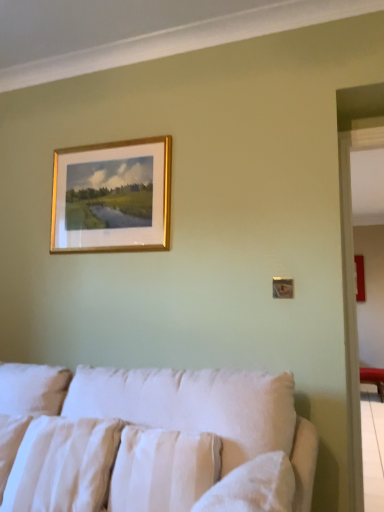
Question: Does gold-framed painting at upper center have a larger size compared to white fabric couch at lower center?

Choices:
 (A) no
 (B) yes

Answer: (A)

Question: From the image's perspective, is gold-framed painting at upper center on white fabric couch at lower center?

Choices:
 (A) yes
 (B) no

Answer: (A)

Question: Is gold-framed painting at upper center shorter than white fabric couch at lower center?

Choices:
 (A) no
 (B) yes

Answer: (B)

Question: Is gold-framed painting at upper center taller than white fabric couch at lower center?

Choices:
 (A) no
 (B) yes

Answer: (A)

Question: From a real-world perspective, is gold-framed painting at upper center physically below white fabric couch at lower center?

Choices:
 (A) yes
 (B) no

Answer: (B)

Question: From a real-world perspective, is gold-framed painting at upper center on white fabric couch at lower center?

Choices:
 (A) no
 (B) yes

Answer: (B)

Question: Does white textured pillow at lower center, arranged as the 1th pillow when viewed from the right, come in front of white fabric couch at lower center?

Choices:
 (A) yes
 (B) no

Answer: (B)

Question: Can you confirm if white textured pillow at lower center, the 2th pillow in the left-to-right sequence, is thinner than white fabric couch at lower center?

Choices:
 (A) yes
 (B) no

Answer: (A)

Question: From a real-world perspective, is white textured pillow at lower center, the 2th pillow in the left-to-right sequence, beneath white fabric couch at lower center?

Choices:
 (A) yes
 (B) no

Answer: (B)

Question: From the image's perspective, is white textured pillow at lower center, the 2th pillow in the left-to-right sequence, on top of white fabric couch at lower center?

Choices:
 (A) yes
 (B) no

Answer: (A)

Question: Does white textured pillow at lower center, the 2th pillow in the left-to-right sequence, have a greater height compared to white fabric couch at lower center?

Choices:
 (A) yes
 (B) no

Answer: (B)

Question: Does white textured pillow at lower center, arranged as the 1th pillow when viewed from the right, appear on the right side of white fabric couch at lower center?

Choices:
 (A) no
 (B) yes

Answer: (B)

Question: Is white cotton pillow at lower left, which is the 2th pillow in right-to-left order, facing towards gold-framed painting at upper center?

Choices:
 (A) yes
 (B) no

Answer: (B)